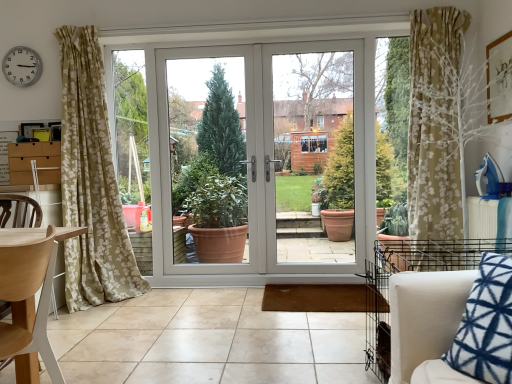
What are the coordinates of `vacant space situated above white plastic door at center, the first window frame positioned from the right (from a real-world perspective)` in the screenshot? It's located at (308, 41).